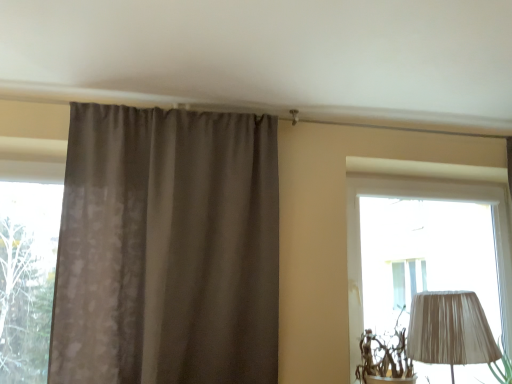
Question: Considering the relative sizes of matte brown curtain at center and transparent glass window at left in the image provided, is matte brown curtain at center bigger than transparent glass window at left?

Choices:
 (A) no
 (B) yes

Answer: (B)

Question: Can you confirm if matte brown curtain at center is smaller than transparent glass window at left?

Choices:
 (A) yes
 (B) no

Answer: (B)

Question: From a real-world perspective, is matte brown curtain at center located beneath transparent glass window at left?

Choices:
 (A) no
 (B) yes

Answer: (A)

Question: Does matte brown curtain at center come behind transparent glass window at left?

Choices:
 (A) no
 (B) yes

Answer: (A)

Question: From the image's perspective, does matte brown curtain at center appear lower than transparent glass window at left?

Choices:
 (A) yes
 (B) no

Answer: (B)

Question: Is matte brown curtain at center aimed at transparent glass window at left?

Choices:
 (A) no
 (B) yes

Answer: (A)

Question: Is transparent glass window at left touching matte brown curtain at center?

Choices:
 (A) no
 (B) yes

Answer: (A)

Question: Is transparent glass window at left thinner than matte brown curtain at center?

Choices:
 (A) yes
 (B) no

Answer: (A)

Question: Is transparent glass window at left oriented away from matte brown curtain at center?

Choices:
 (A) yes
 (B) no

Answer: (B)

Question: Can you confirm if transparent glass window at left is shorter than matte brown curtain at center?

Choices:
 (A) no
 (B) yes

Answer: (B)

Question: Does transparent glass window at left turn towards matte brown curtain at center?

Choices:
 (A) yes
 (B) no

Answer: (B)

Question: Is transparent glass window at left taller than matte brown curtain at center?

Choices:
 (A) no
 (B) yes

Answer: (A)

Question: Is transparent glass window at left inside or outside of matte brown curtain at center?

Choices:
 (A) outside
 (B) inside

Answer: (A)